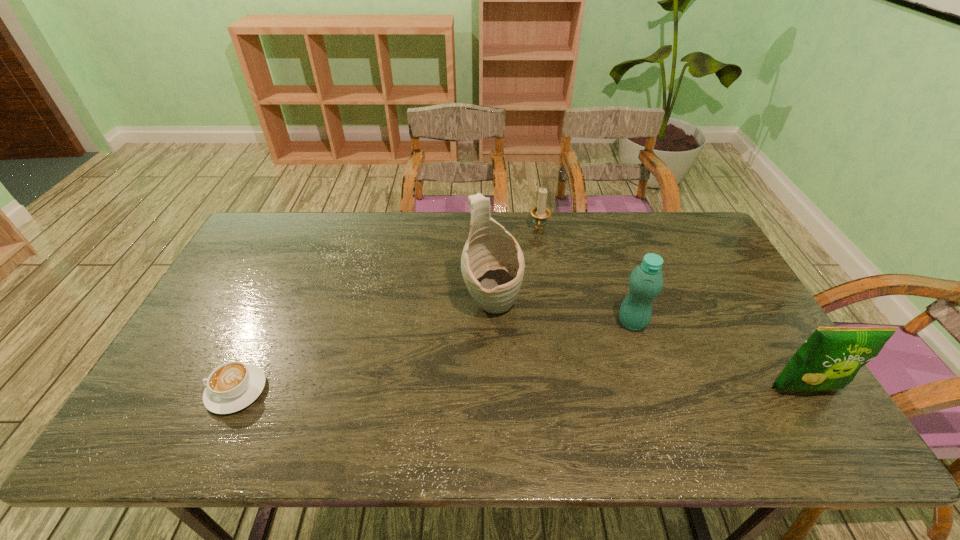
In the image, there is a desktop. Find the location of `vacant region at the near left corner`. vacant region at the near left corner is located at coordinates (172, 381).

At what (x,y) coordinates should I click in order to perform the action: click on free space at the far right corner of the desktop. Please return your answer as a coordinate pair (x, y). Looking at the image, I should click on (687, 248).

Find the location of a particular element. free space at the near right corner of the desktop is located at coordinates (793, 392).

This screenshot has width=960, height=540. I want to click on unoccupied position between the pitcher and the shortest object, so click(x=364, y=347).

Identify the location of free point between the rightmost object and the candle_holder. The image size is (960, 540). (672, 309).

Locate an element on the screen. Image resolution: width=960 pixels, height=540 pixels. vacant point located between the farthest object and the rightmost object is located at coordinates (672, 309).

Locate an element on the screen. The width and height of the screenshot is (960, 540). vacant space that is in between the fourth tallest object and the leftmost object is located at coordinates pos(388,310).

Locate an element on the screen. unoccupied position between the farthest object and the shortest object is located at coordinates (x=388, y=310).

The image size is (960, 540). I want to click on vacant area between the candle_holder and the water bottle, so click(586, 276).

At what (x,y) coordinates should I click in order to perform the action: click on vacant area that lies between the fourth tallest object and the water bottle. Please return your answer as a coordinate pair (x, y). The height and width of the screenshot is (540, 960). Looking at the image, I should click on [x=586, y=276].